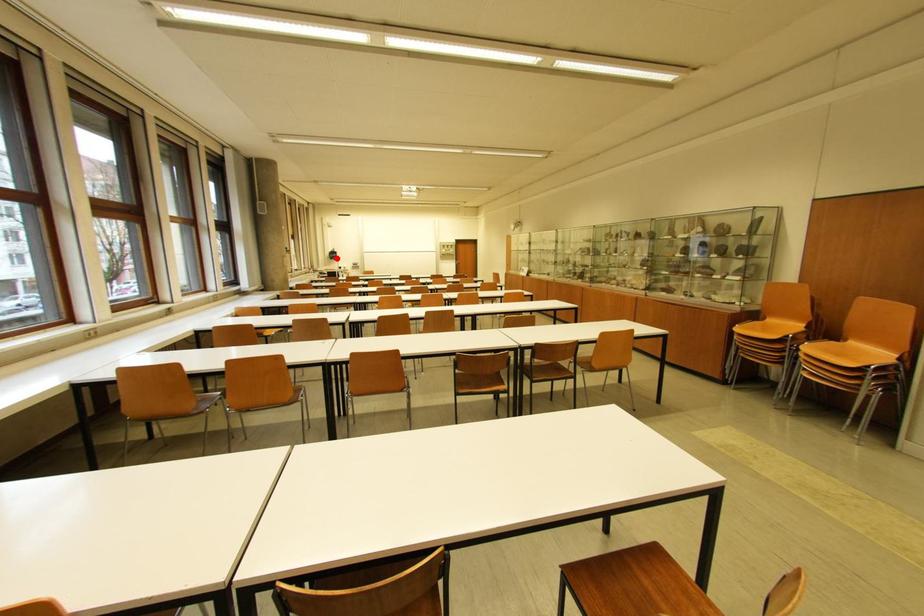
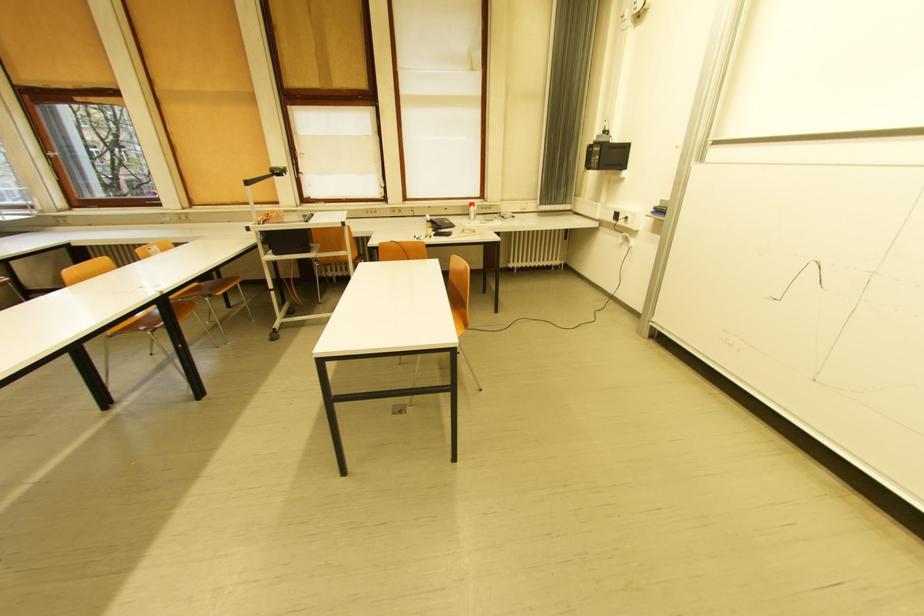
Find the pixel in the second image that matches the highlighted location in the first image.

(592, 168)